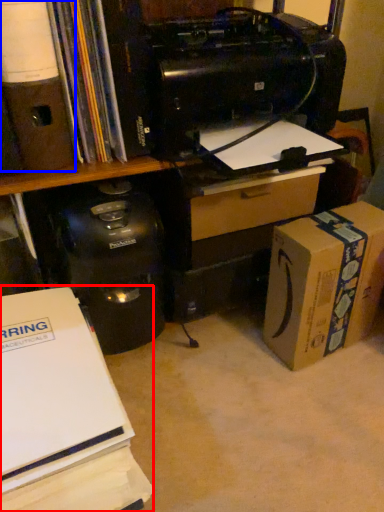
Question: Which point is further to the camera, office supplies (highlighted by a red box) or office supplies (highlighted by a blue box)?

Choices:
 (A) office supplies
 (B) office supplies

Answer: (B)